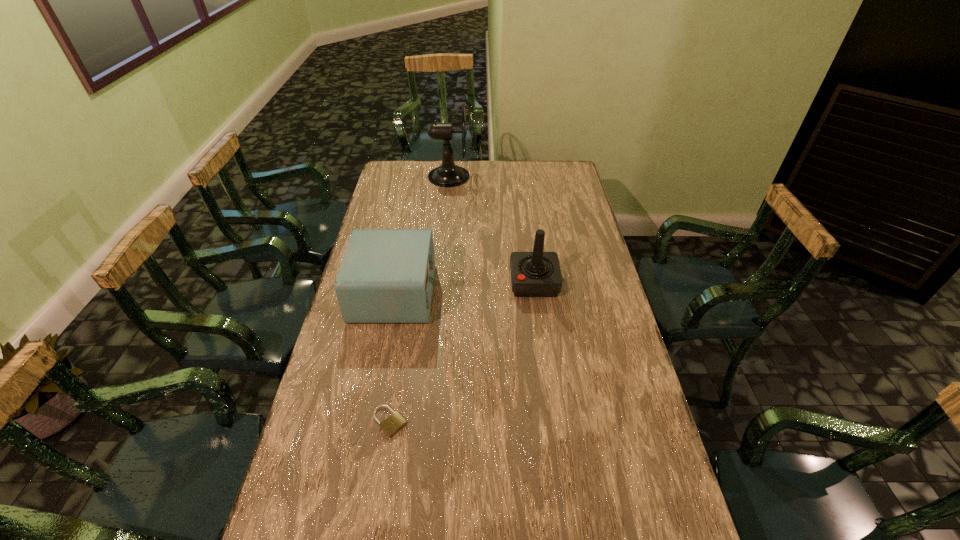
Where is `the tallest object`? The image size is (960, 540). the tallest object is located at coordinates (448, 174).

The width and height of the screenshot is (960, 540). Identify the location of fan. (448, 174).

Where is `the rightmost object`? The image size is (960, 540). the rightmost object is located at coordinates (533, 274).

This screenshot has width=960, height=540. In order to click on joystick in this screenshot , I will do `click(533, 274)`.

Locate an element on the screen. The image size is (960, 540). radio receiver is located at coordinates (386, 275).

Where is `padlock`? The height and width of the screenshot is (540, 960). padlock is located at coordinates (391, 425).

Where is `the shortest object`? Image resolution: width=960 pixels, height=540 pixels. the shortest object is located at coordinates (391, 425).

Find the location of a particular element. This screenshot has height=540, width=960. vacant space located on the front-facing side of the farthest object is located at coordinates (490, 177).

You are a GUI agent. You are given a task and a screenshot of the screen. Output one action in this format:
    pyautogui.click(x=<x>, y=<y>)
    Task: Click on the free space located 0.290m on the front-facing side of the third shortest object
    The image size is (960, 540).
    Given the screenshot: What is the action you would take?
    pyautogui.click(x=429, y=282)

Locate an element on the screen. The image size is (960, 540). free space located 0.200m on the front-facing side of the third shortest object is located at coordinates (454, 282).